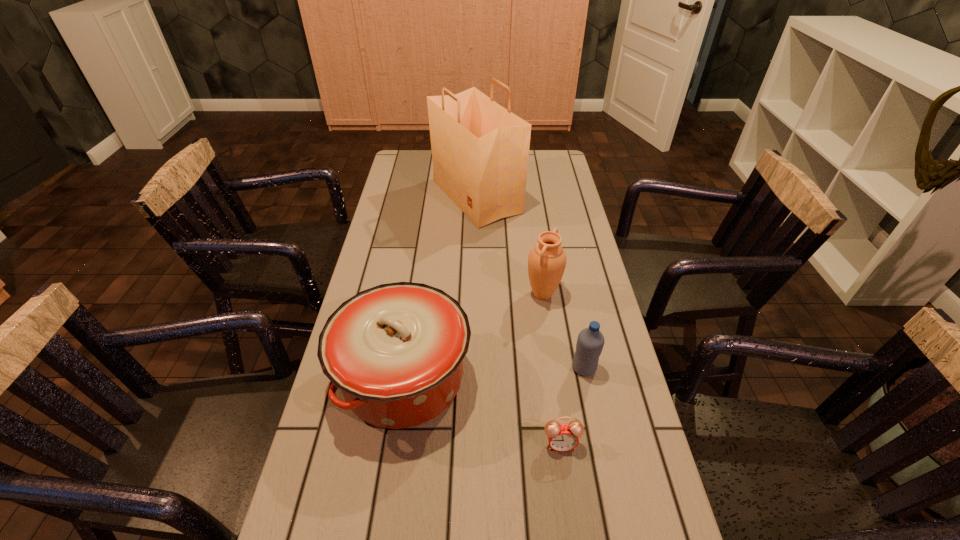
Locate an element on the screen. The width and height of the screenshot is (960, 540). vacant area that lies between the water bottle and the casserole is located at coordinates (493, 373).

You are a GUI agent. You are given a task and a screenshot of the screen. Output one action in this format:
    pyautogui.click(x=<x>, y=<y>)
    Task: Click on the free space between the second farthest object and the casserole
    
    Given the screenshot: What is the action you would take?
    pyautogui.click(x=473, y=336)

This screenshot has width=960, height=540. What are the coordinates of `free space between the fourth nearest object and the casserole` in the screenshot? It's located at (473, 336).

You are a GUI agent. You are given a task and a screenshot of the screen. Output one action in this format:
    pyautogui.click(x=<x>, y=<y>)
    Task: Click on the free area in between the farthest object and the fourth nearest object
    Image resolution: width=960 pixels, height=540 pixels.
    Given the screenshot: What is the action you would take?
    pyautogui.click(x=510, y=245)

Identify the location of object that is the third nearest to the casserole. The image size is (960, 540). (590, 342).

Image resolution: width=960 pixels, height=540 pixels. I want to click on object that is the third closest to the second farthest object, so click(x=480, y=150).

Identify the location of vacant space that satisfies the following two spatial constraints: 1. on the side of the grocery bag with the superhero design; 2. on the left side of the second farthest object. (475, 294).

The width and height of the screenshot is (960, 540). Find the location of `vacant area in the image that satisfies the following two spatial constraints: 1. on the side of the grocery bag with the superhero design; 2. on the left side of the urn`. vacant area in the image that satisfies the following two spatial constraints: 1. on the side of the grocery bag with the superhero design; 2. on the left side of the urn is located at coordinates (475, 294).

Find the location of a particular element. vacant space that satisfies the following two spatial constraints: 1. on the back side of the casserole; 2. on the left side of the second shortest object is located at coordinates (405, 368).